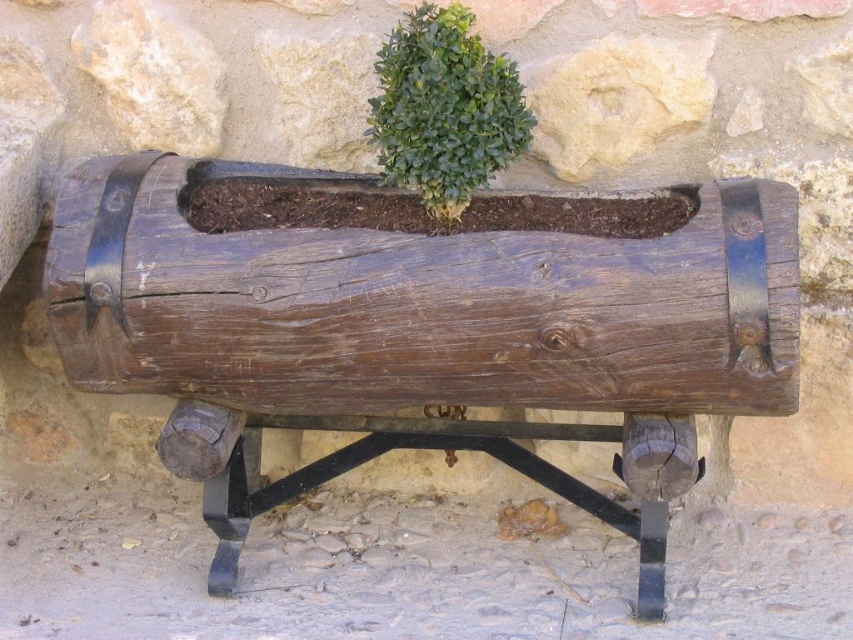
Does rustic wood planter at center come in front of green leafy bush at center?

Yes, it is in front of green leafy bush at center.

Where is `rustic wood planter at center`? This screenshot has width=853, height=640. rustic wood planter at center is located at coordinates (422, 323).